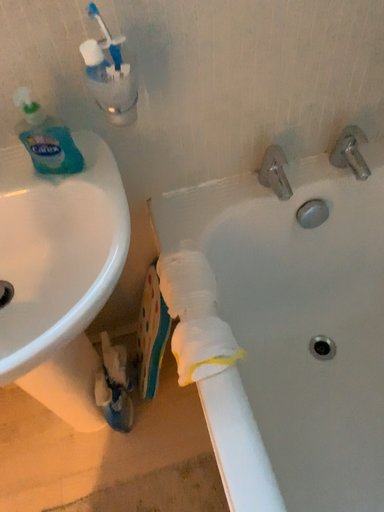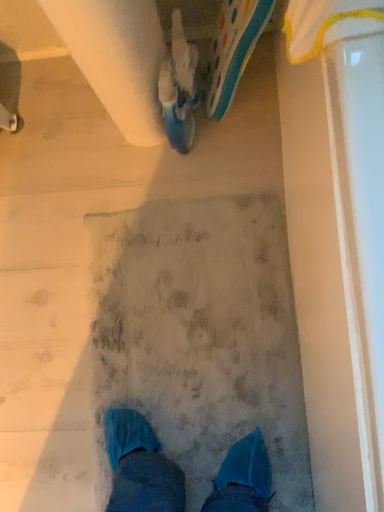
Question: How did the camera likely rotate when shooting the video?

Choices:
 (A) rotated right
 (B) rotated left

Answer: (B)